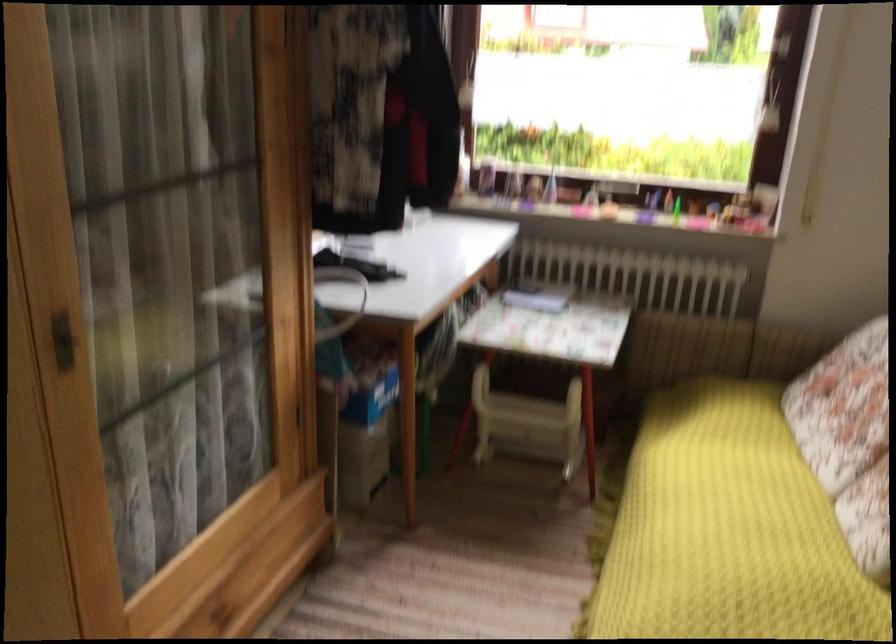
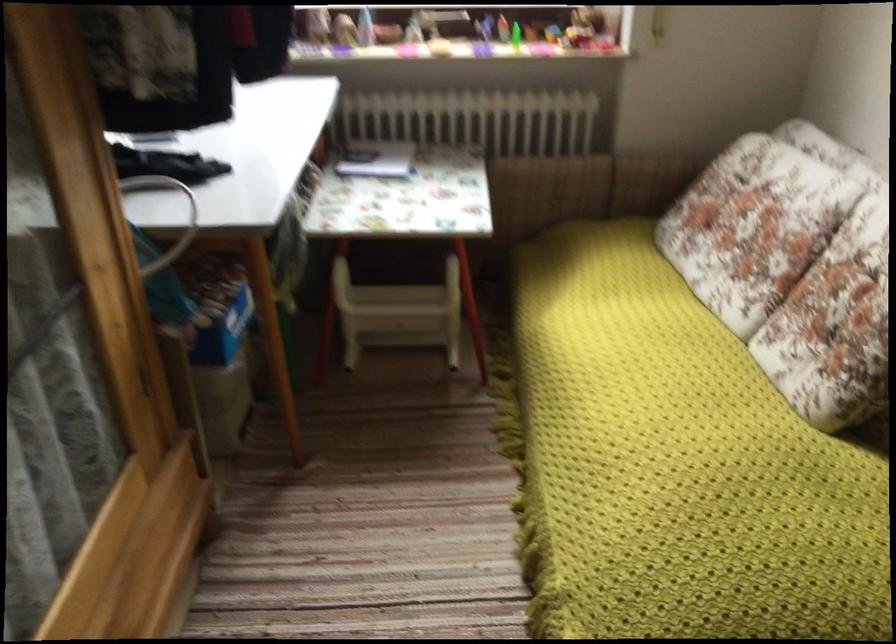
Question: The images are taken continuously from a first-person perspective. In which direction is your viewpoint rotating?

Choices:
 (A) Left
 (B) Right
 (C) Up
 (D) Down

Answer: (B)